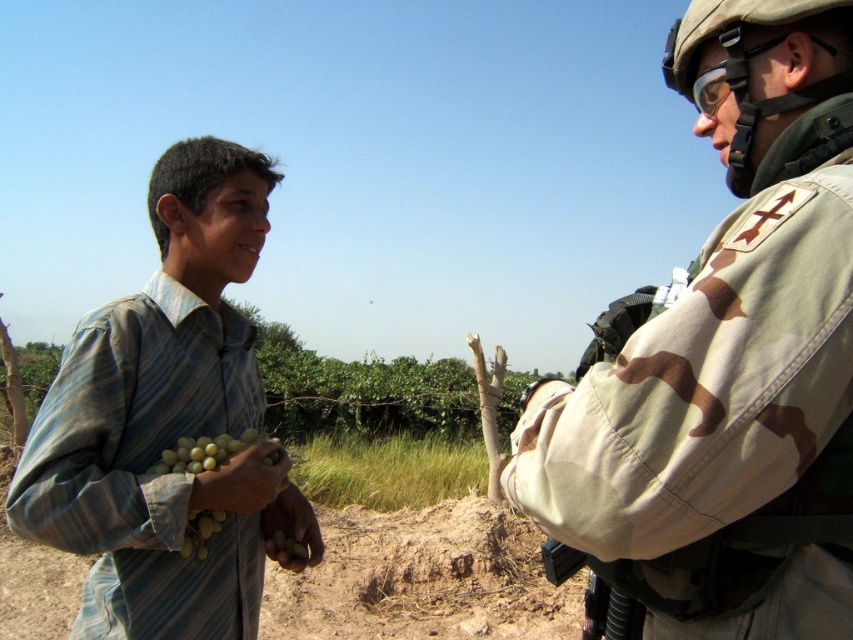
Question: Is striped fabric boy at left to the right of green matte grapes at lower left from the viewer's perspective?

Choices:
 (A) yes
 (B) no

Answer: (B)

Question: Which object is positioned closest to the striped fabric boy at left?

Choices:
 (A) green matte grapes at lower left
 (B) camouflage fabric gun at right

Answer: (A)

Question: Is camouflage fabric uniform at right further to camera compared to camouflage fabric gun at right?

Choices:
 (A) yes
 (B) no

Answer: (B)

Question: Among these points, which one is farthest from the camera?

Choices:
 (A) (627, 628)
 (B) (224, 522)
 (C) (785, 403)

Answer: (B)

Question: Which object appears farthest from the camera in this image?

Choices:
 (A) camouflage fabric uniform at right
 (B) green matte grapes at lower left

Answer: (B)

Question: Is camouflage fabric gun at right in front of green matte grapes at lower left?

Choices:
 (A) yes
 (B) no

Answer: (A)